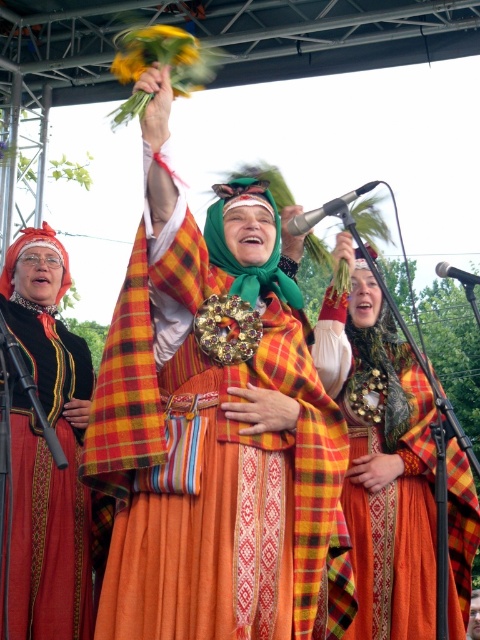
Question: Which object is positioned closest to the matte black dress at left?

Choices:
 (A) metallic silver microphone at upper center
 (B) metallic shiny microphone at upper center
 (C) matte orange dress at center

Answer: (C)

Question: Which object appears closest to the camera in this image?

Choices:
 (A) metallic shiny microphone at upper center
 (B) metallic silver microphone at upper center
 (C) matte orange dress at center

Answer: (B)

Question: Is plaid fabric dress at center thinner than matte black dress at left?

Choices:
 (A) yes
 (B) no

Answer: (B)

Question: Observing the image, what is the correct spatial positioning of matte orange dress at center in reference to metallic shiny microphone at upper center?

Choices:
 (A) below
 (B) above

Answer: (A)

Question: Can you confirm if matte orange dress at center is positioned below metallic silver microphone at upper center?

Choices:
 (A) yes
 (B) no

Answer: (A)

Question: Which of the following is the closest to the observer?

Choices:
 (A) plaid fabric dress at center
 (B) matte orange dress at center

Answer: (A)